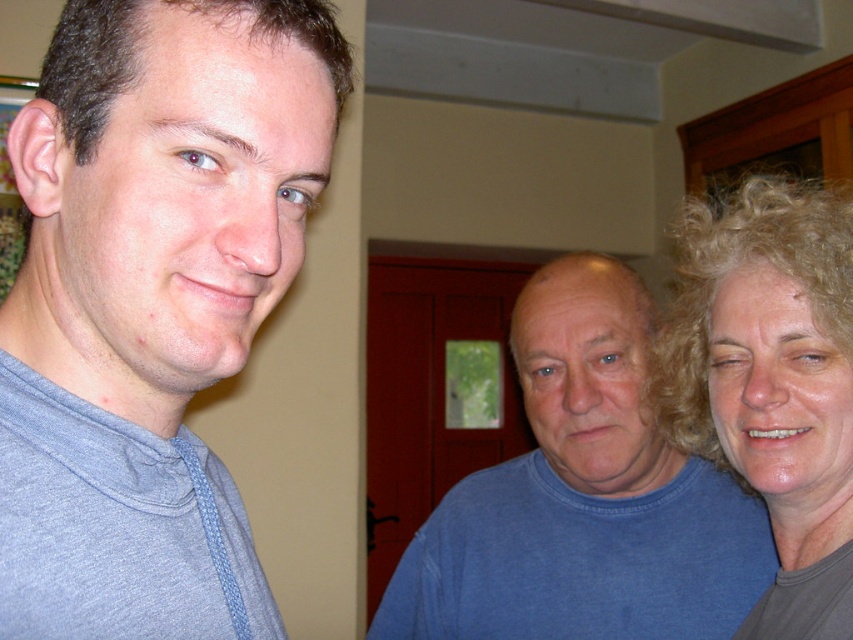
Does gray cotton shirt at left appear on the left side of blue cotton shirt at center?

Yes, gray cotton shirt at left is to the left of blue cotton shirt at center.

The height and width of the screenshot is (640, 853). What do you see at coordinates (173, 205) in the screenshot?
I see `gray cotton shirt at left` at bounding box center [173, 205].

Locate an element on the screen. The height and width of the screenshot is (640, 853). gray cotton shirt at left is located at coordinates (173, 205).

Between point (286, 49) and point (828, 419), which one is positioned in front?

Point (286, 49)

Is gray cotton shirt at left positioned in front of curly blonde hair at right?

Yes, it is in front of curly blonde hair at right.

Is point (170, 218) behind point (807, 438)?

No, it is not.

Image resolution: width=853 pixels, height=640 pixels. Identify the location of gray cotton shirt at left. pyautogui.click(x=173, y=205).

You are a GUI agent. You are given a task and a screenshot of the screen. Output one action in this format:
    pyautogui.click(x=<x>, y=<y>)
    Task: Click on the blue cotton shirt at center
    The image size is (853, 640).
    Given the screenshot: What is the action you would take?
    pyautogui.click(x=583, y=497)

Between blue cotton shirt at center and curly blonde hair at right, which one is positioned lower?

blue cotton shirt at center is lower down.

Between point (596, 381) and point (664, 403), which one is positioned behind?

Point (596, 381)

At what (x,y) coordinates should I click in order to perform the action: click on blue cotton shirt at center. Please return your answer as a coordinate pair (x, y). This screenshot has width=853, height=640. Looking at the image, I should click on (583, 497).